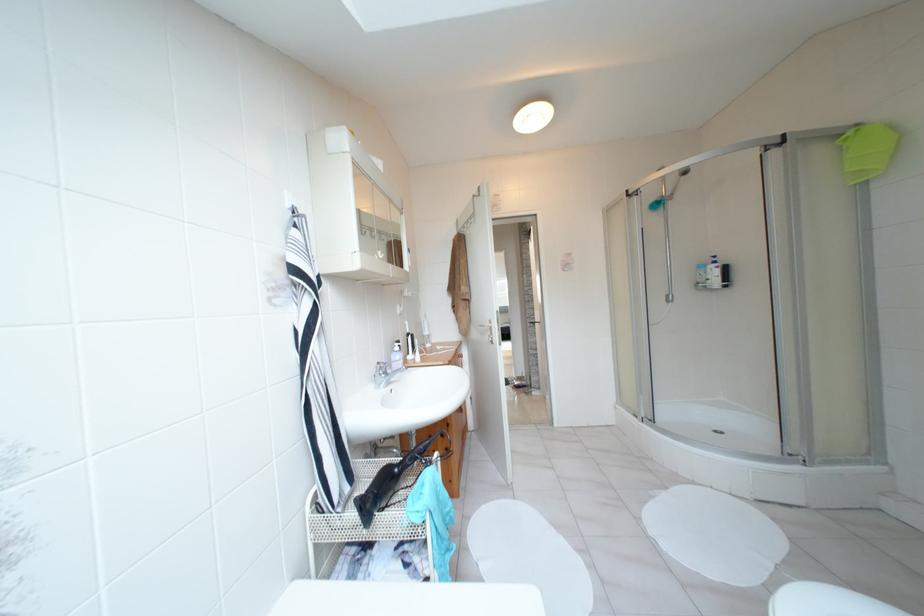
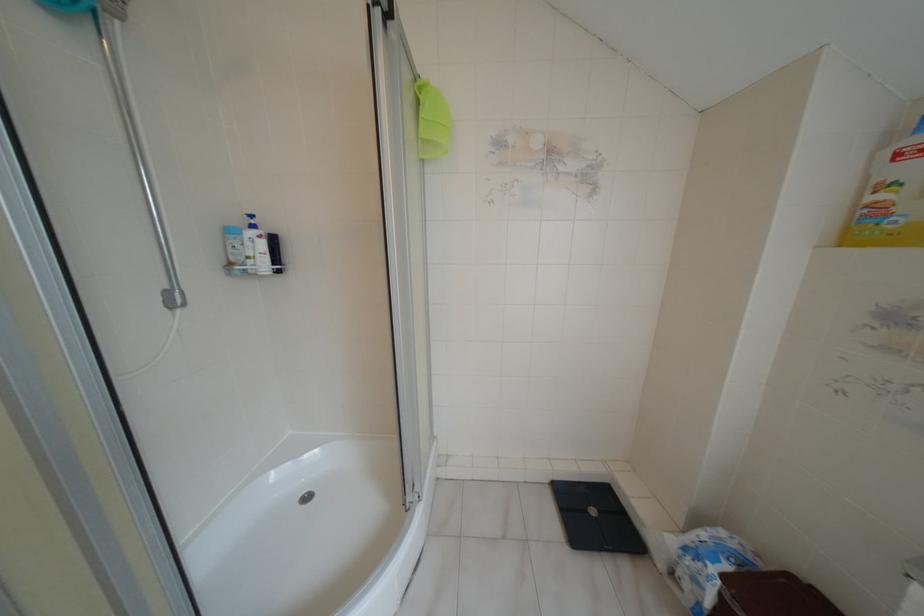
Where in the second image is the point corresponding to (713,257) from the first image?

(251, 216)